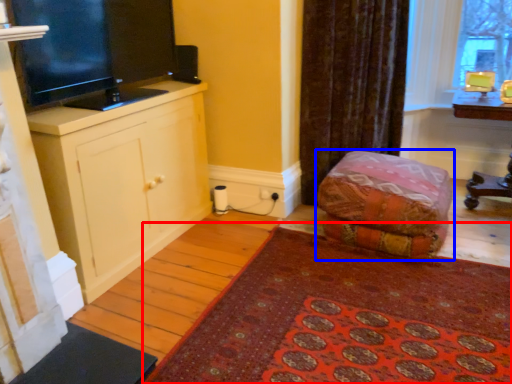
Question: Which object appears farthest to the camera in this image, mat (highlighted by a red box) or furniture (highlighted by a blue box)?

Choices:
 (A) mat
 (B) furniture

Answer: (B)